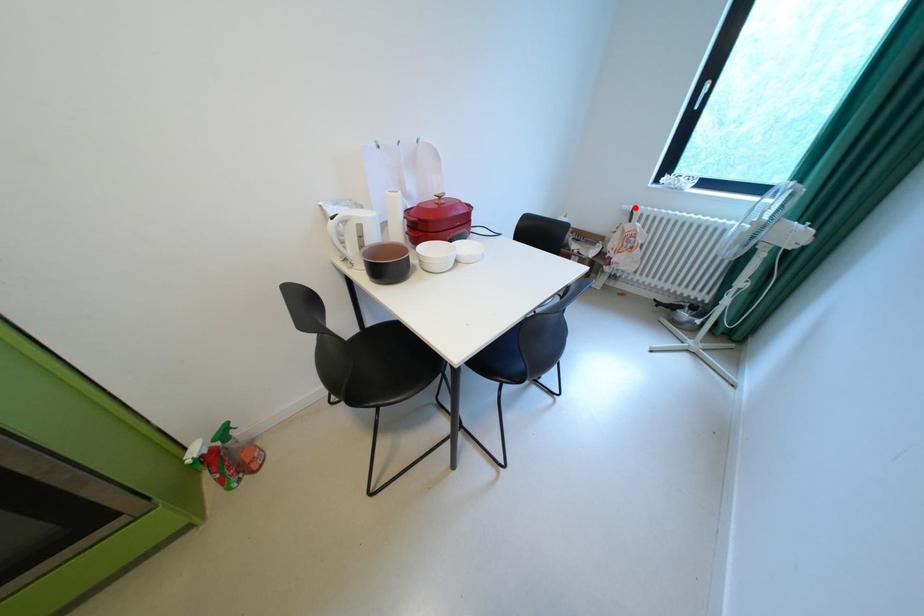
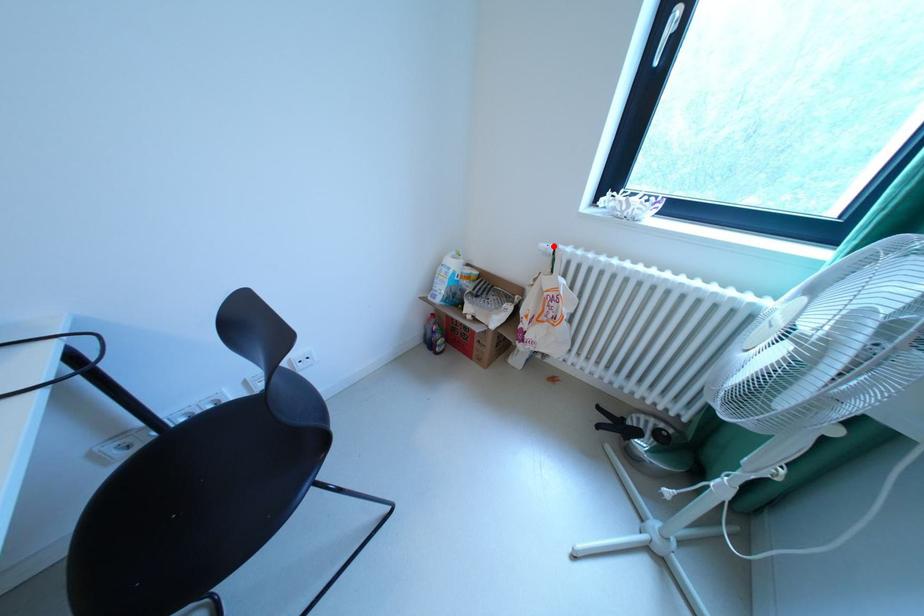
I am providing you with two images of the same scene from different viewpoints. A red point is marked on the first image and another point is marked on the second image. Is the marked point in image1 the same physical position as the marked point in image2?

Yes